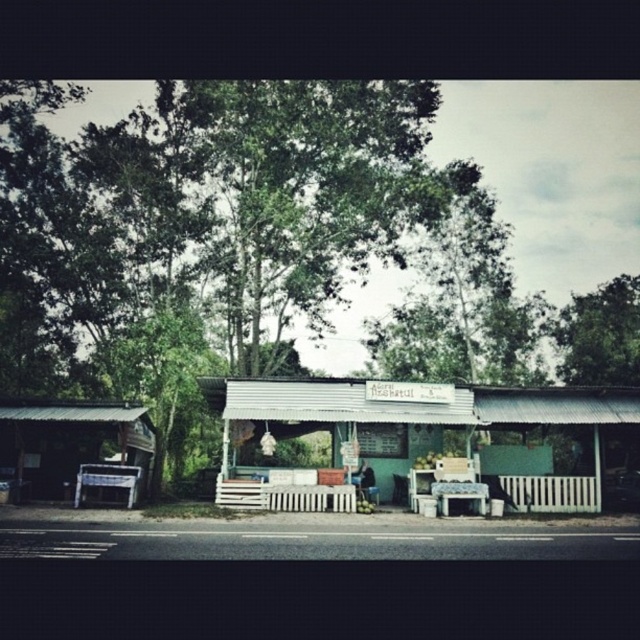
Is point (16, 483) positioned after point (436, 456)?

No, it is not.

The image size is (640, 640). I want to click on green corrugated metal hut at left, so click(x=68, y=444).

Consider the image. Between green corrugated metal hut at center and green corrugated metal hut at left, which one is positioned higher?

green corrugated metal hut at center is higher up.

The image size is (640, 640). What do you see at coordinates (428, 435) in the screenshot?
I see `green corrugated metal hut at center` at bounding box center [428, 435].

Identify the location of green corrugated metal hut at center. (428, 435).

Is point (104, 483) positioned after point (438, 512)?

No, (104, 483) is in front of (438, 512).

Is white plastic picnic table at left above white plastic table at center?

Correct, white plastic picnic table at left is located above white plastic table at center.

Between point (83, 472) and point (464, 481), which one is positioned behind?

The point (83, 472) is more distant.

Where is `white plastic picnic table at left`? This screenshot has width=640, height=640. white plastic picnic table at left is located at coordinates (108, 480).